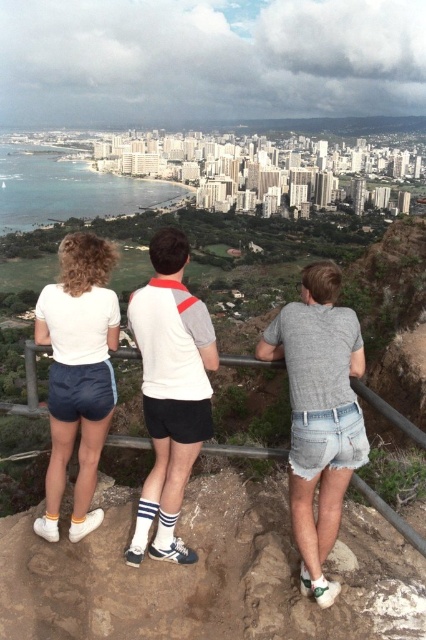
Does denim shorts at center have a greater height compared to white fabric shirt at center?

Incorrect, denim shorts at center's height is not larger of white fabric shirt at center's.

Who is higher up, denim shorts at center or white fabric shirt at center?

Positioned higher is white fabric shirt at center.

Between point (302, 358) and point (160, 410), which one is positioned in front?

Positioned in front is point (160, 410).

Image resolution: width=426 pixels, height=640 pixels. I want to click on denim shorts at center, so click(x=319, y=413).

Is denim shorts at center further to camera compared to white matte shorts at left?

That is False.

Who is more forward, (310, 502) or (40, 320)?

Positioned in front is point (310, 502).

This screenshot has width=426, height=640. What are the coordinates of `denim shorts at center` in the screenshot? It's located at (319, 413).

Find the location of a particular element. The height and width of the screenshot is (640, 426). denim shorts at center is located at coordinates (319, 413).

Does white matte shorts at left appear on the left side of metallic gray rail at center?

Indeed, white matte shorts at left is positioned on the left side of metallic gray rail at center.

Between white matte shorts at left and metallic gray rail at center, which one appears on the right side from the viewer's perspective?

metallic gray rail at center

Locate an element on the screen. white matte shorts at left is located at coordinates (77, 372).